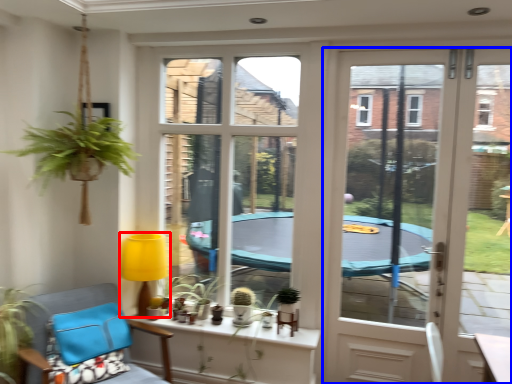
Question: Among these objects, which one is nearest to the camera, lamp (highlighted by a red box) or door (highlighted by a blue box)?

Choices:
 (A) lamp
 (B) door

Answer: (B)